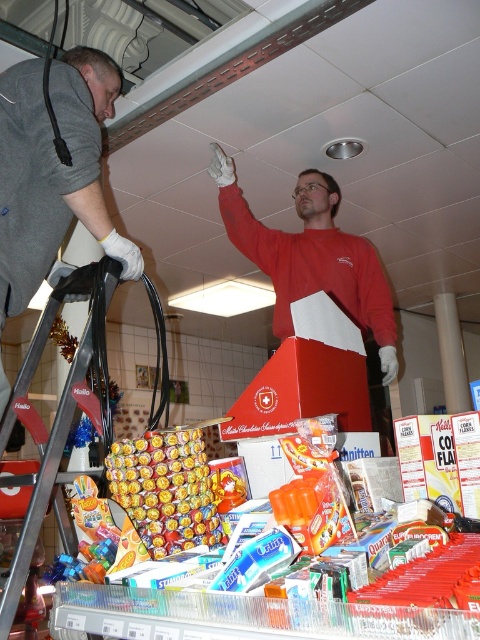
Is point (269, 253) closer to viewer compared to point (39, 355)?

No, (269, 253) is further to viewer.

I want to click on matte red sweater at upper center, so click(312, 257).

Identify the location of matte red sweater at upper center. Image resolution: width=480 pixels, height=640 pixels. (312, 257).

Locate an element on the screen. matte red sweater at upper center is located at coordinates (312, 257).

Which is above, gray fabric jacket at left or matte red sweater at upper center?

Positioned higher is gray fabric jacket at left.

Is point (17, 269) positioned after point (357, 278)?

No, it is not.

Describe the element at coordinates (54, 170) in the screenshot. The width and height of the screenshot is (480, 640). I see `gray fabric jacket at left` at that location.

Find the location of a particular element. gray fabric jacket at left is located at coordinates (54, 170).

Is gray fabric jacket at left smaller than metallic silver ladder at left?

No, gray fabric jacket at left is not smaller than metallic silver ladder at left.

The width and height of the screenshot is (480, 640). Describe the element at coordinates (54, 170) in the screenshot. I see `gray fabric jacket at left` at that location.

Between point (86, 160) and point (14, 566), which one is positioned behind?

Point (86, 160)

In order to click on gray fabric jacket at left in this screenshot , I will do `click(54, 170)`.